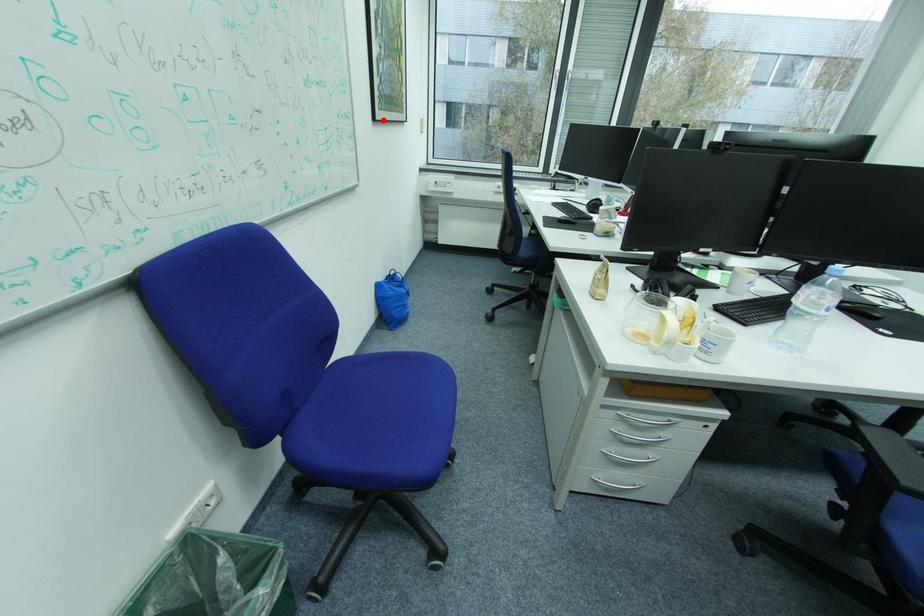
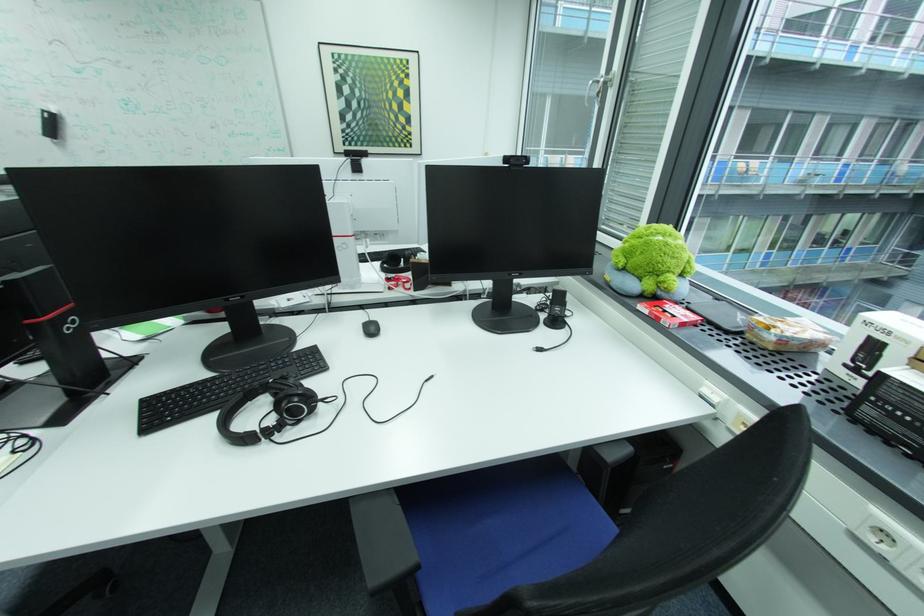
Find the pixel in the second image that matches the highlighted location in the first image.

(344, 153)